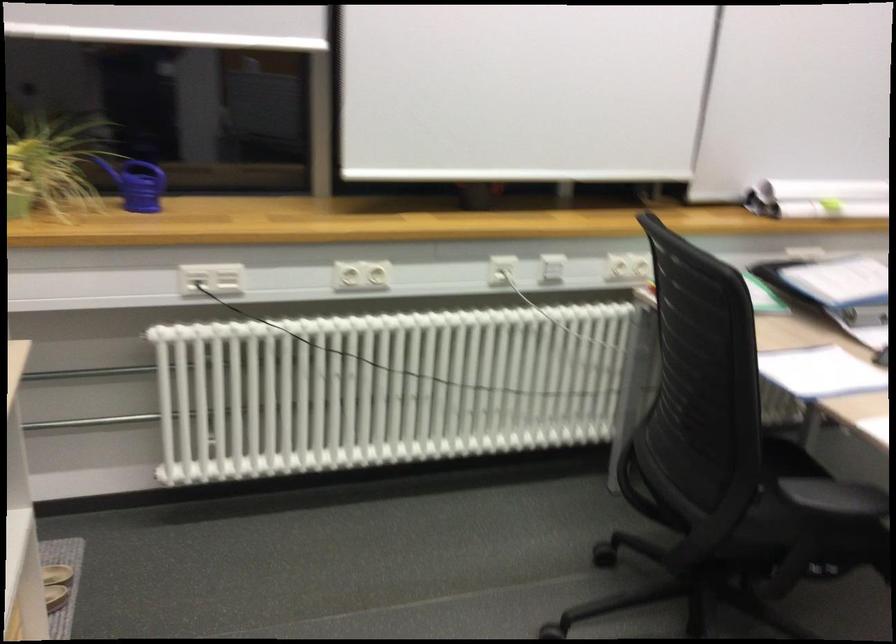
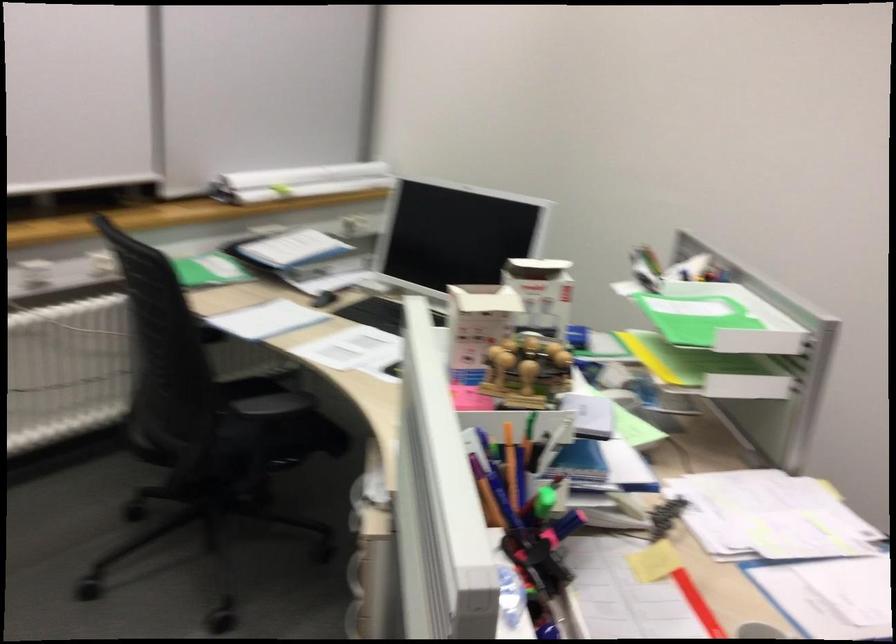
In a continuous first-person perspective shot, in which direction is the camera moving?

The movement direction of the cameraman is right, backward.